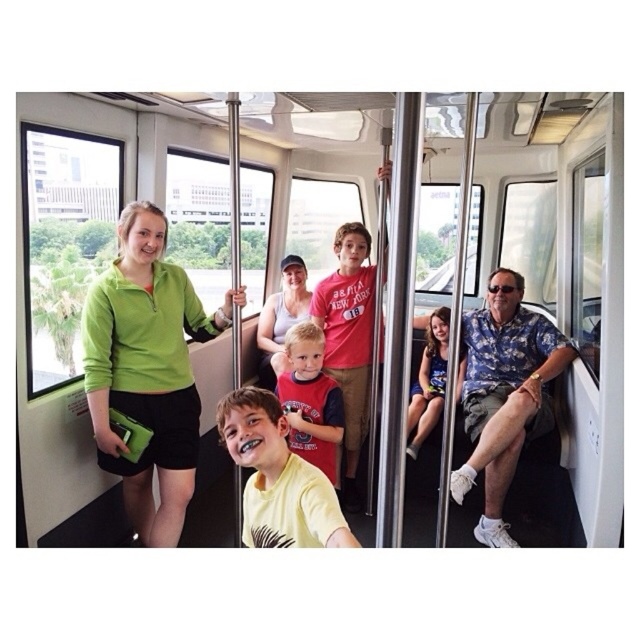
Is green matte jacket at center positioned behind matte white tank top at center?

No.

Between green matte jacket at center and matte white tank top at center, which one is positioned lower?

Positioned lower is green matte jacket at center.

Between point (150, 214) and point (264, 326), which one is positioned behind?

Positioned behind is point (264, 326).

Image resolution: width=640 pixels, height=640 pixels. In order to click on green matte jacket at center in this screenshot , I will do `click(147, 369)`.

Is yellow fabric bus at center positioned behind blue denim dress at center?

Yes.

Can you confirm if yellow fabric bus at center is wider than blue denim dress at center?

Indeed, yellow fabric bus at center has a greater width compared to blue denim dress at center.

Does point (385, 129) come in front of point (436, 380)?

Yes.

Where is `yellow fabric bus at center`? yellow fabric bus at center is located at coordinates (564, 272).

Who is taller, red cotton shirt at center or matte white tank top at center?

matte white tank top at center is taller.

In the scene shown: Can you confirm if red cotton shirt at center is taller than matte white tank top at center?

In fact, red cotton shirt at center may be shorter than matte white tank top at center.

Does point (323, 406) lie behind point (301, 308)?

No, (323, 406) is in front of (301, 308).

Locate an element on the screen. red cotton shirt at center is located at coordinates (310, 401).